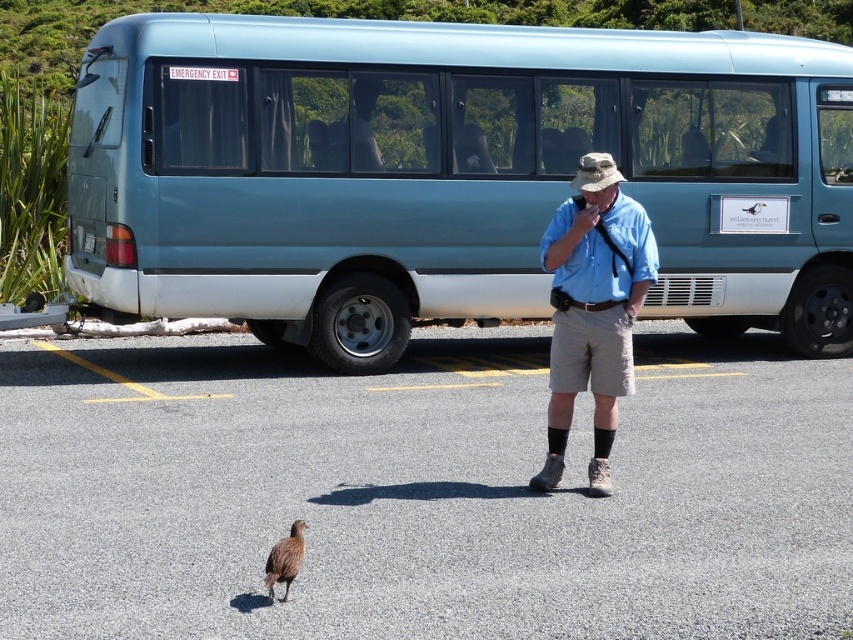
Question: Which of the following is the closest to the observer?

Choices:
 (A) gray asphalt parking lot at center
 (B) blue cotton shirt at center
 (C) teal matte bus at upper center

Answer: (A)

Question: Is gray asphalt parking lot at center further to the viewer compared to blue cotton shirt at center?

Choices:
 (A) yes
 (B) no

Answer: (B)

Question: Which of these objects is positioned closest to the blue cotton shirt at center?

Choices:
 (A) brown feathered bird at lower center
 (B) gray asphalt parking lot at center
 (C) teal matte bus at upper center

Answer: (B)

Question: Which object appears closest to the camera in this image?

Choices:
 (A) blue cotton shirt at center
 (B) brown feathered bird at lower center

Answer: (B)

Question: Does gray asphalt parking lot at center have a smaller size compared to brown feathered bird at lower center?

Choices:
 (A) no
 (B) yes

Answer: (A)

Question: Can you confirm if blue cotton shirt at center is bigger than brown feathered bird at lower center?

Choices:
 (A) yes
 (B) no

Answer: (A)